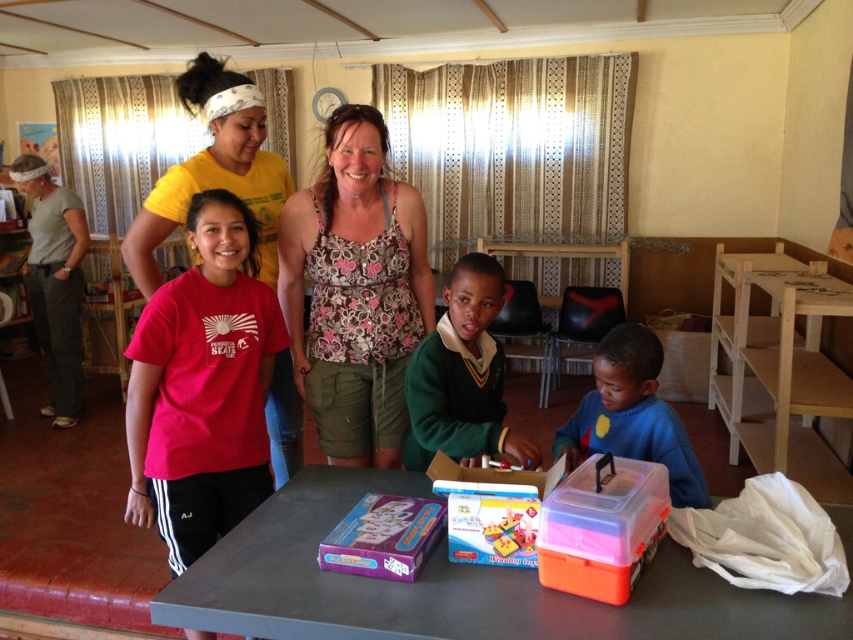
Which is behind, point (751, 452) or point (515, 524)?

The point (751, 452) is more distant.

The height and width of the screenshot is (640, 853). What do you see at coordinates (778, 362) in the screenshot? I see `light brown wooden table at right` at bounding box center [778, 362].

Is point (824, 413) farther from viewer compared to point (514, 538)?

Yes, point (824, 413) is farther from viewer.

You are a GUI agent. You are given a task and a screenshot of the screen. Output one action in this format:
    pyautogui.click(x=<x>, y=<y>)
    Task: Click on the light brown wooden table at right
    Image resolution: width=853 pixels, height=640 pixels.
    Given the screenshot: What is the action you would take?
    pyautogui.click(x=778, y=362)

Who is positioned more to the right, matte yellow t-shirt at center or blue matte plastic container at lower right?

Positioned to the right is blue matte plastic container at lower right.

Consider the image. Between matte yellow t-shirt at center and blue matte plastic container at lower right, which one has more height?

Standing taller between the two is matte yellow t-shirt at center.

Find the location of a particular element. The height and width of the screenshot is (640, 853). matte yellow t-shirt at center is located at coordinates (213, 170).

Is metallic gray table at center to the left of matte yellow t-shirt at center from the viewer's perspective?

Incorrect, metallic gray table at center is not on the left side of matte yellow t-shirt at center.

Is point (225, 586) in front of point (192, 176)?

Yes, point (225, 586) is in front of point (192, 176).

Who is more forward, (834, 516) or (247, 160)?

Point (834, 516) is in front.

The height and width of the screenshot is (640, 853). I want to click on metallic gray table at center, so click(453, 586).